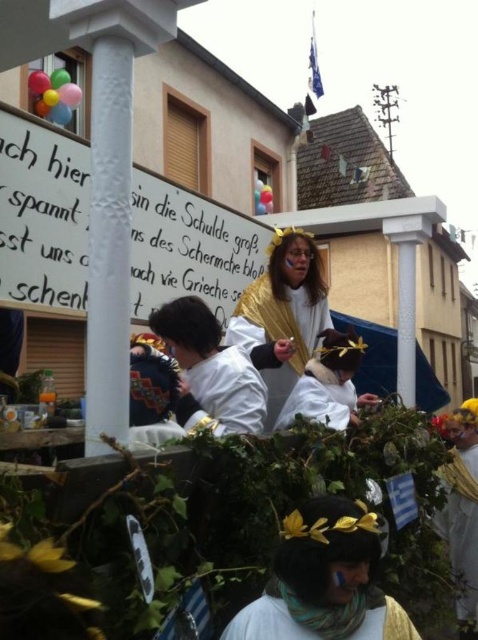
Does gold metallic cape at center appear over white matte costume at center?

Correct, gold metallic cape at center is located above white matte costume at center.

Is gold metallic cape at center smaller than white matte costume at center?

Actually, gold metallic cape at center might be larger than white matte costume at center.

Based on the photo, who is more forward, (289, 250) or (300, 392)?

Positioned in front is point (300, 392).

At what (x,y) coordinates should I click in order to perform the action: click on gold metallic cape at center. Please return your answer as a coordinate pair (x, y). The image size is (478, 640). Looking at the image, I should click on (282, 316).

Image resolution: width=478 pixels, height=640 pixels. What do you see at coordinates (270, 620) in the screenshot?
I see `white fabric headband at center` at bounding box center [270, 620].

Can you confirm if white fabric headband at center is positioned above white matte costume at center?

Incorrect, white fabric headband at center is not positioned above white matte costume at center.

Between point (293, 627) and point (293, 396), which one is positioned behind?

The point (293, 396) is more distant.

You are a GUI agent. You are given a task and a screenshot of the screen. Output one action in this format:
    pyautogui.click(x=<x>, y=<y>)
    Task: Click on the white fabric headband at center
    
    Given the screenshot: What is the action you would take?
    pyautogui.click(x=270, y=620)

Measure the distance between gold metallic cape at center and camera.

3.72 meters

Which is more to the right, gold metallic cape at center or white fabric headband at center?

white fabric headband at center is more to the right.

Identify the location of gold metallic cape at center. (282, 316).